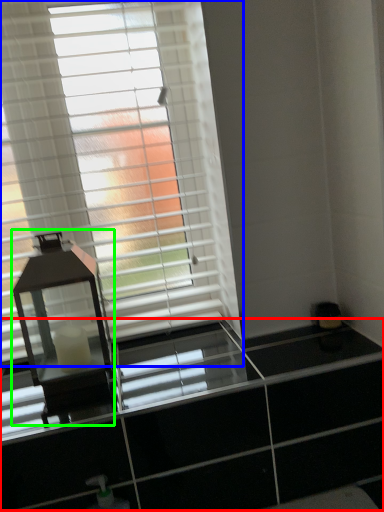
Question: Based on their relative distances, which object is farther from dresser (highlighted by a red box)? Choose from window blind (highlighted by a blue box) and table lamp (highlighted by a green box).

Choices:
 (A) window blind
 (B) table lamp

Answer: (A)